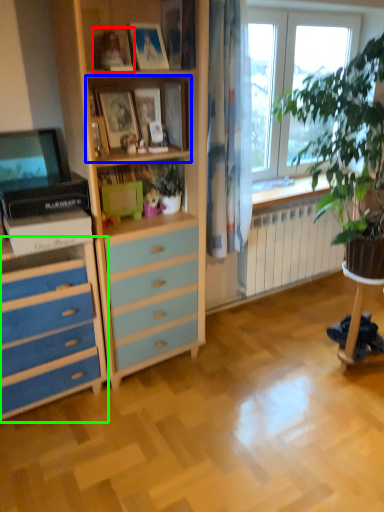
Question: Based on their relative distances, which object is nearer to picture frame (highlighted by a red box)? Choose from shelf (highlighted by a blue box) and chest of drawers (highlighted by a green box).

Choices:
 (A) shelf
 (B) chest of drawers

Answer: (A)